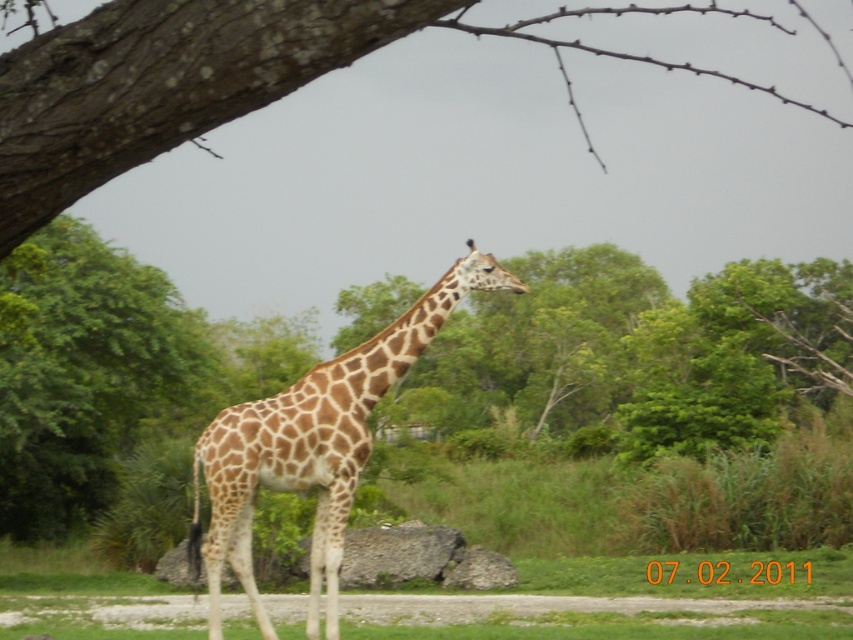
Question: Does green grass at lower center appear over spotted fur giraffe at center?

Choices:
 (A) no
 (B) yes

Answer: (A)

Question: Which of the following is the closest to the observer?

Choices:
 (A) brown rough bark at upper left
 (B) spotted fur giraffe at center

Answer: (A)

Question: Which is farther from the green grass at lower center?

Choices:
 (A) spotted fur giraffe at center
 (B) brown rough bark at upper left

Answer: (B)

Question: Does brown rough bark at upper left appear over spotted fur giraffe at center?

Choices:
 (A) yes
 (B) no

Answer: (A)

Question: Which is farther from the brown rough bark at upper left?

Choices:
 (A) spotted fur giraffe at center
 (B) green grass at lower center

Answer: (B)

Question: Is green grass at lower center positioned at the back of spotted fur giraffe at center?

Choices:
 (A) yes
 (B) no

Answer: (A)